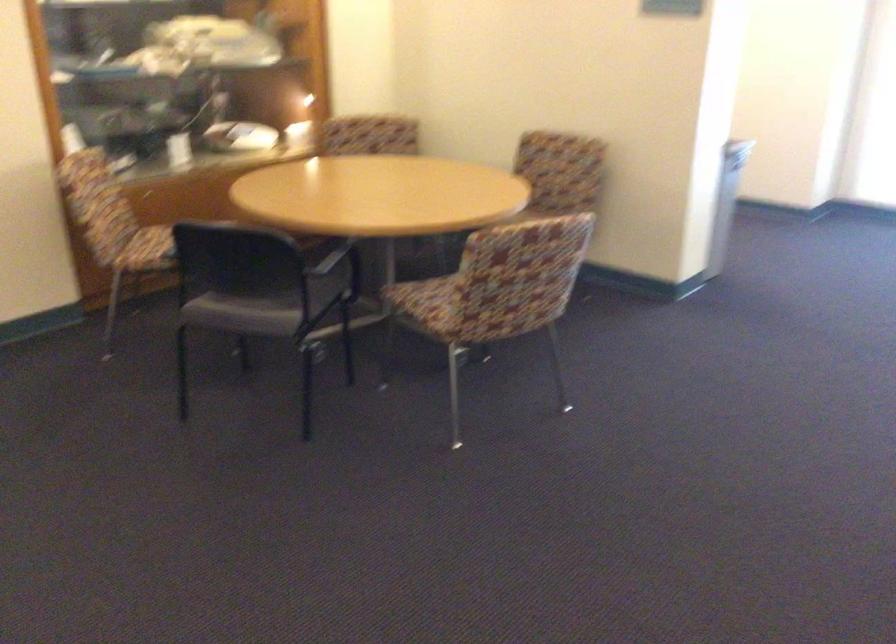
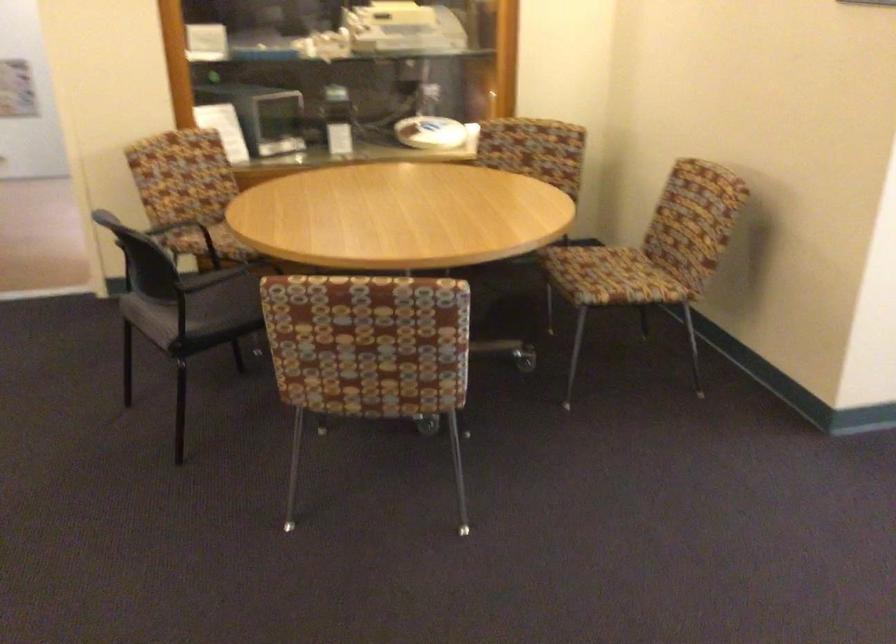
Find the pixel in the second image that matches (527,281) in the first image.

(368, 353)